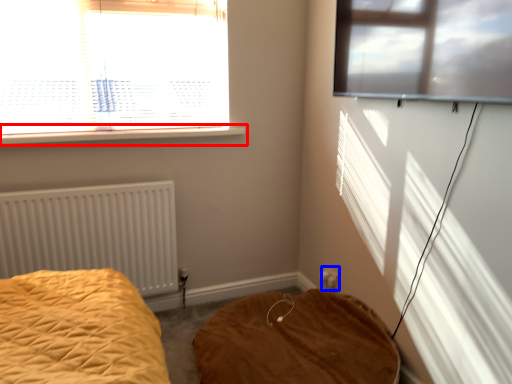
Question: Among these objects, which one is farthest to the camera, window sill (highlighted by a red box) or electric outlet (highlighted by a blue box)?

Choices:
 (A) window sill
 (B) electric outlet

Answer: (B)